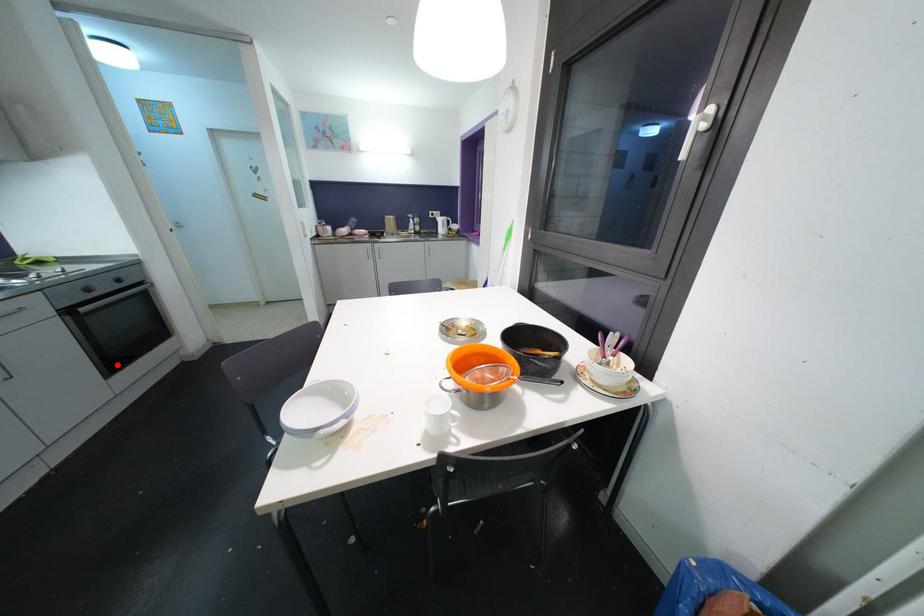
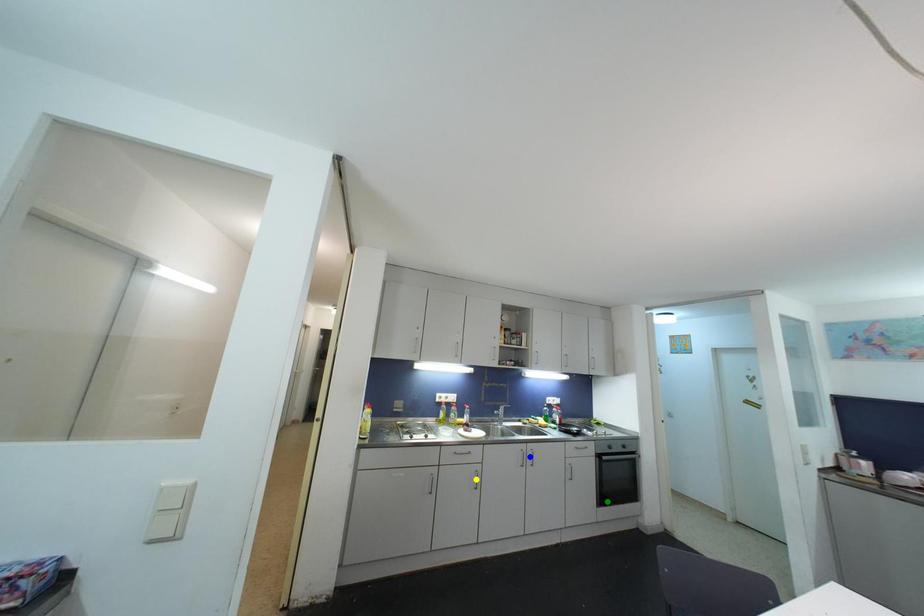
Question: I am providing you with two images of the same scene from different viewpoints. A red point is marked on the first image. You are given multiple points on the second image. Which point in image 2 is actually the same real-world point as the red point in image 1?

Choices:
 (A) yellow point
 (B) green point
 (C) blue point

Answer: (B)